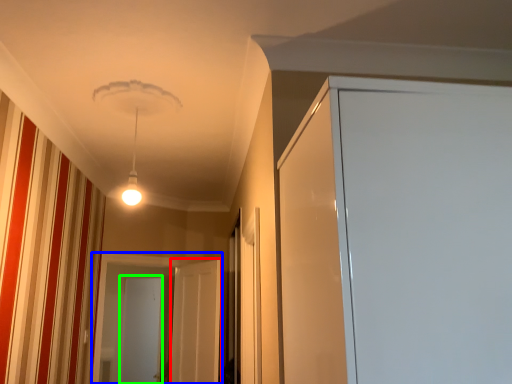
Question: Considering the real-world distances, which object is farthest from screen door (highlighted by a red box)? screen door (highlighted by a blue box) or screen door (highlighted by a green box)?

Choices:
 (A) screen door
 (B) screen door

Answer: (B)